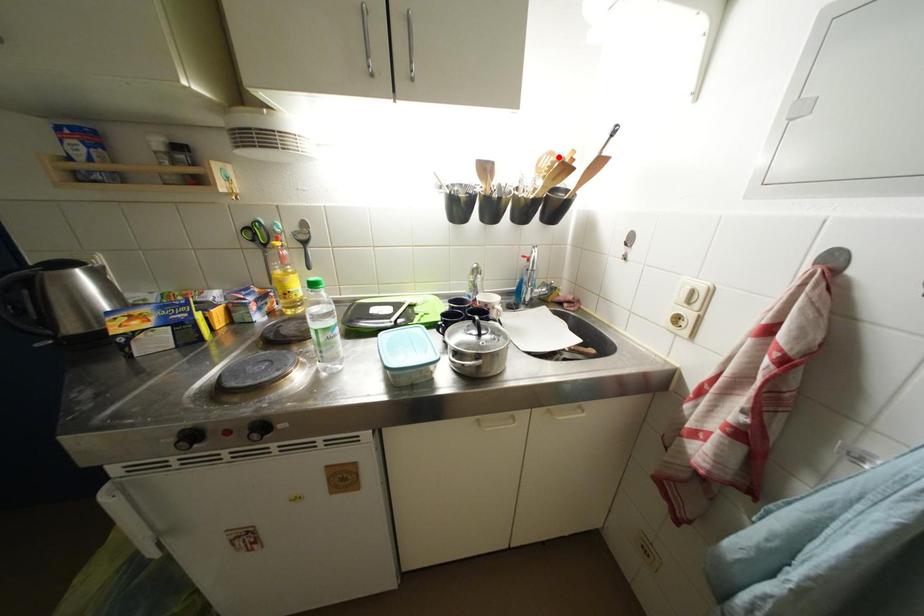
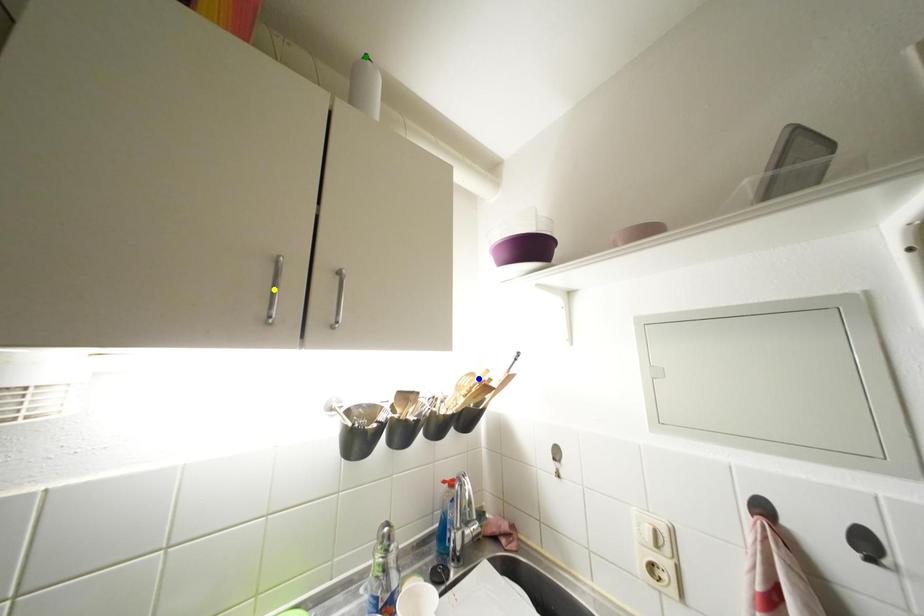
Question: I am providing you with two images of the same scene from different viewpoints. A red point is marked on the first image. You are given multiple points on the second image. Which point in image 2 represents the same 3d spot as the red point in image 1?

Choices:
 (A) green point
 (B) blue point
 (C) yellow point

Answer: (B)